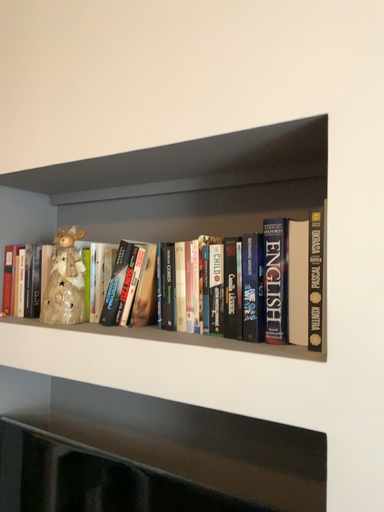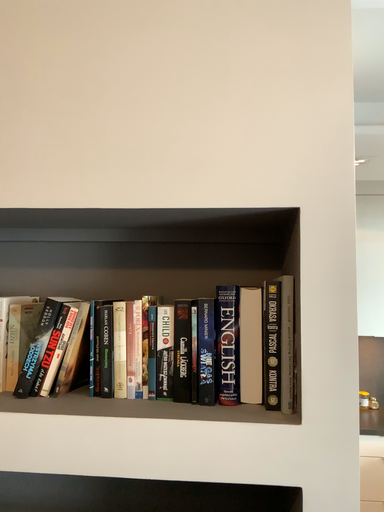
Question: How did the camera likely rotate when shooting the video?

Choices:
 (A) rotated right
 (B) rotated left

Answer: (A)